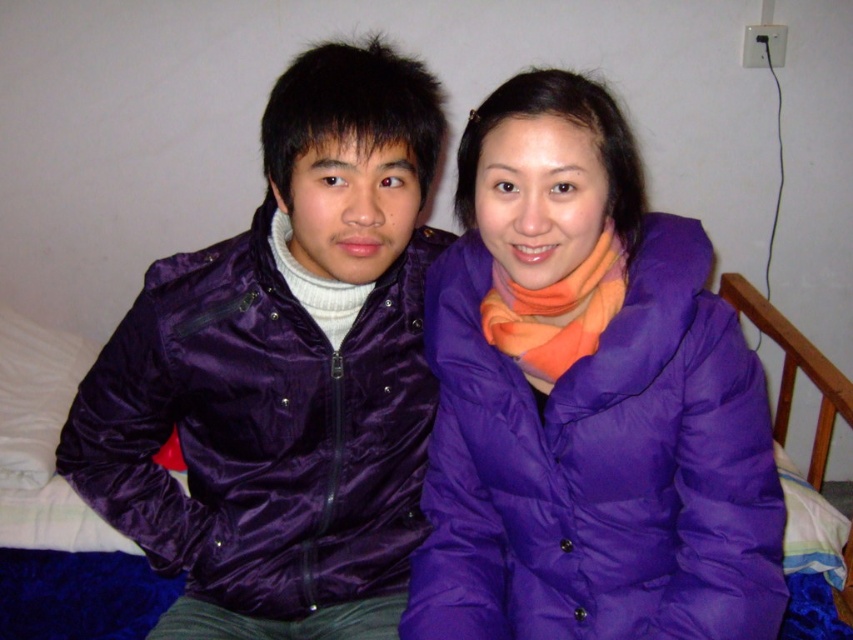
Question: Is purple down jacket at right below satin purple jacket at left?

Choices:
 (A) yes
 (B) no

Answer: (B)

Question: Which of the following is the farthest from the observer?

Choices:
 (A) (688, 500)
 (B) (335, 490)

Answer: (B)

Question: Is purple down jacket at right further to camera compared to satin purple jacket at left?

Choices:
 (A) no
 (B) yes

Answer: (A)

Question: Can you confirm if purple down jacket at right is wider than satin purple jacket at left?

Choices:
 (A) yes
 (B) no

Answer: (B)

Question: Among these points, which one is farthest from the camera?

Choices:
 (A) (653, 282)
 (B) (372, 380)

Answer: (B)